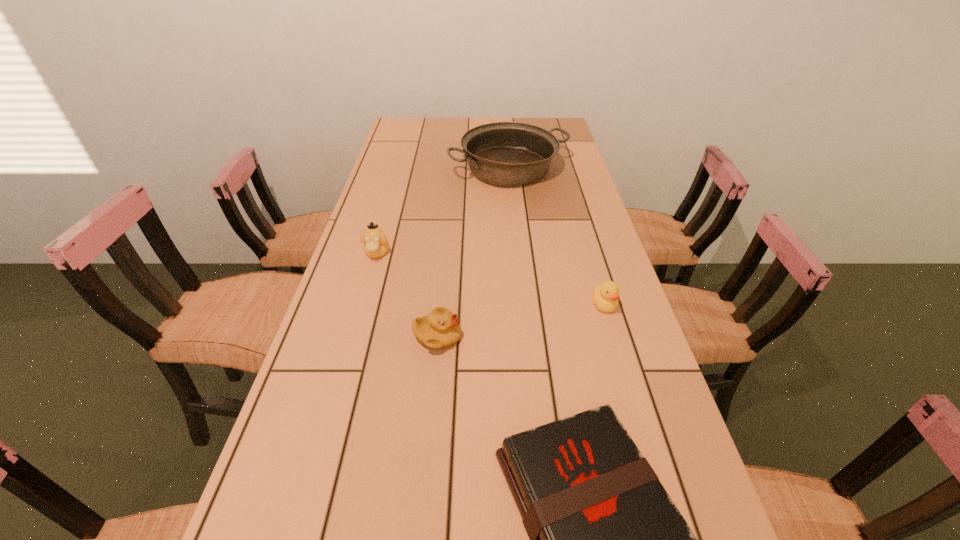
Locate an element on the screen. free space located on the face of the rightmost duckling is located at coordinates (622, 364).

In order to click on object located in the left edge section of the desktop in this screenshot , I will do `click(376, 245)`.

Find the location of a particular element. pan located in the right edge section of the desktop is located at coordinates pyautogui.click(x=502, y=153).

Locate an element on the screen. This screenshot has width=960, height=540. duckling that is at the right edge is located at coordinates (605, 296).

Identify the location of vacant region at the far edge of the desktop. The height and width of the screenshot is (540, 960). (483, 121).

The width and height of the screenshot is (960, 540). I want to click on blank space at the left edge of the desktop, so click(x=372, y=183).

At what (x,y) coordinates should I click in order to perform the action: click on vacant space at the right edge of the desktop. Please return your answer as a coordinate pair (x, y). Looking at the image, I should click on (592, 207).

Locate an element on the screen. Image resolution: width=960 pixels, height=540 pixels. free space between the farthest object and the second duckling from right to left is located at coordinates tap(473, 253).

Locate an element on the screen. The width and height of the screenshot is (960, 540). free space between the fourth nearest object and the fourth farthest object is located at coordinates (407, 295).

Identify which object is located as the second nearest to the leftmost object. Please provide its 2D coordinates. Your answer should be formatted as a tuple, i.e. [(x, y)], where the tuple contains the x and y coordinates of a point satisfying the conditions above.

[(502, 153)]